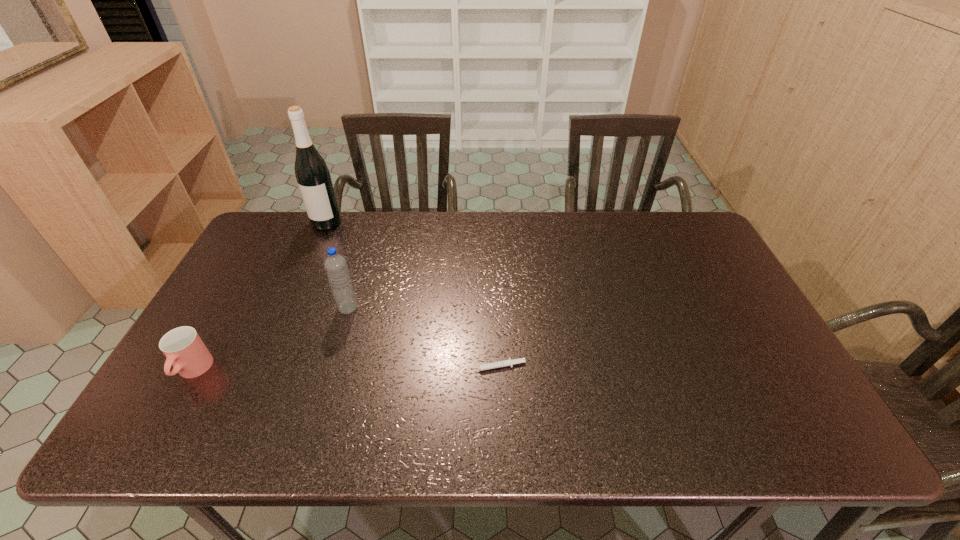
Locate an element on the screen. The image size is (960, 540). vacant area that satisfies the following two spatial constraints: 1. on the label of the shortest object; 2. on the left side of the third object from right to left is located at coordinates (264, 367).